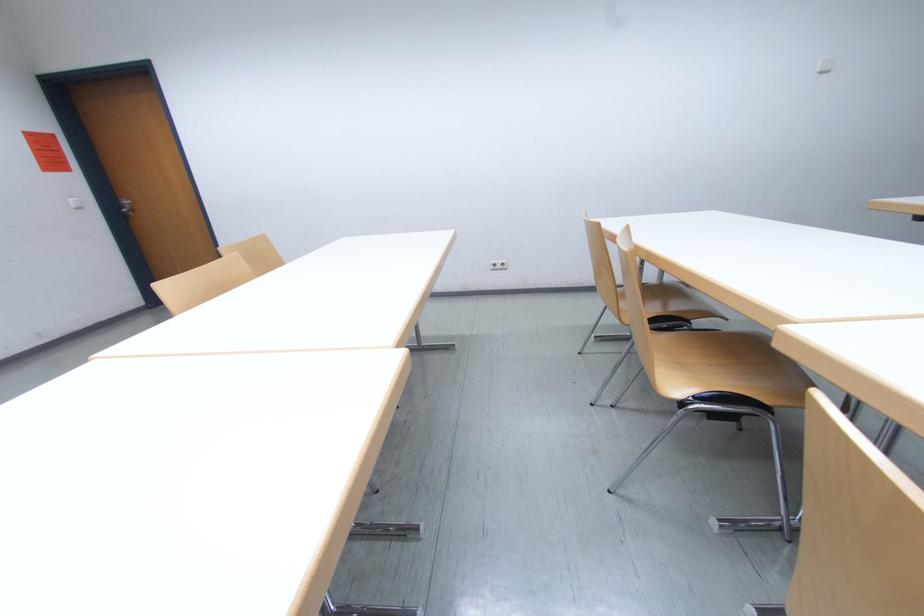
I want to click on chair sitting surface, so pyautogui.click(x=721, y=366).